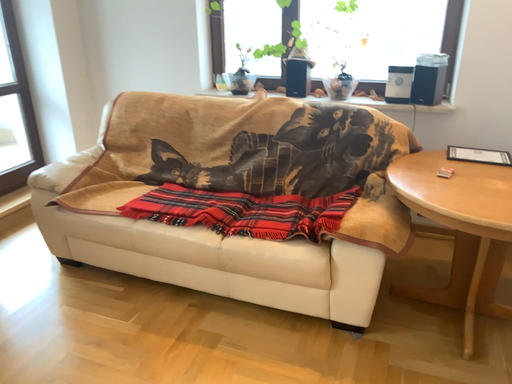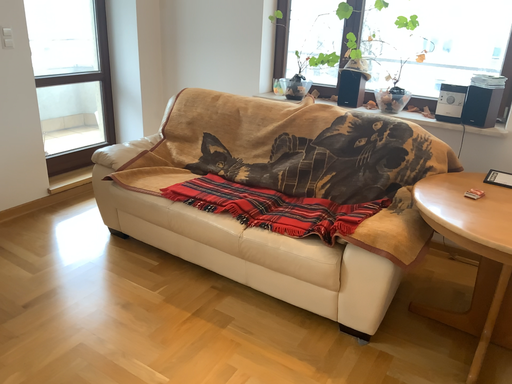
Question: Which way did the camera rotate in the video?

Choices:
 (A) rotated left
 (B) rotated right

Answer: (A)